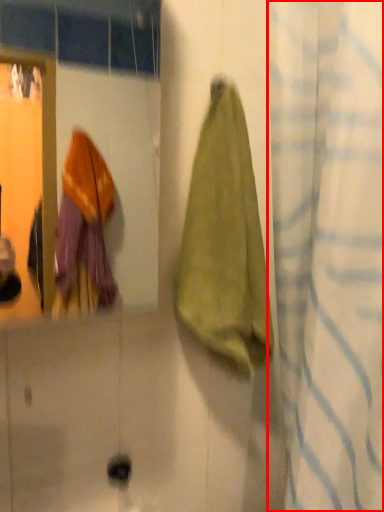
Question: Considering the relative positions of curtain (annotated by the red box) and towel in the image provided, where is curtain (annotated by the red box) located with respect to the staircase?

Choices:
 (A) right
 (B) left

Answer: (A)